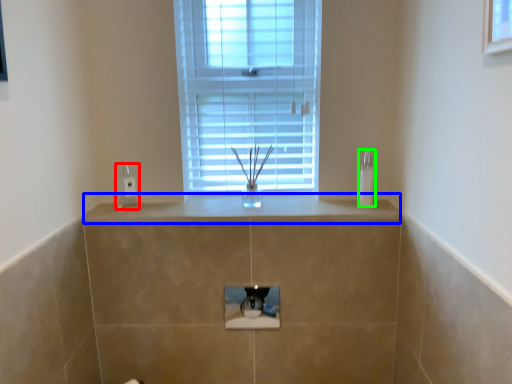
Question: Considering the real-world distances, which object is farthest from electric outlet (highlighted by a red box)? counter top (highlighted by a blue box) or soap dispenser (highlighted by a green box)?

Choices:
 (A) counter top
 (B) soap dispenser

Answer: (B)